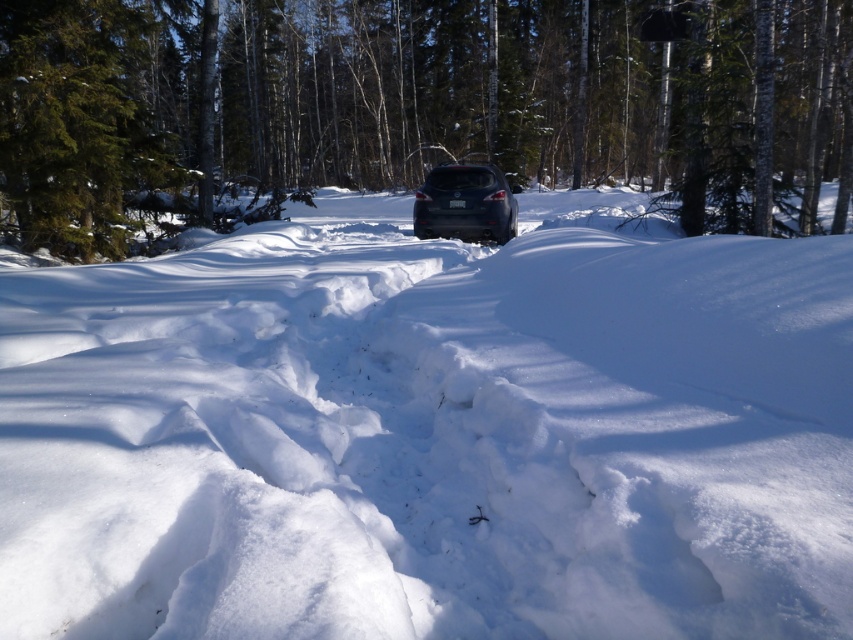
You are a photographer planning to capture the snowy forest scene. You want to ensure that the white fluffy snow at center and the satin dark gray suv at center are both clearly visible in your shot. Considering their sizes, which one should you focus on to ensure proper exposure?

The white fluffy snow at center has a larger width than the satin dark gray suv at center. Since the snow is brighter and covers more area, you should focus on exposing for the snow to prevent overexposure, ensuring details in both the snow and the SUV are retained.

You are a photographer planning to take a picture of the white fluffy snow at center and the satin dark gray suv at center. Based on their heights, which object should you focus on first to ensure both are in frame?

The white fluffy snow at center is taller than the satin dark gray suv at center, so you should focus on the white fluffy snow at center first to ensure both are in frame.